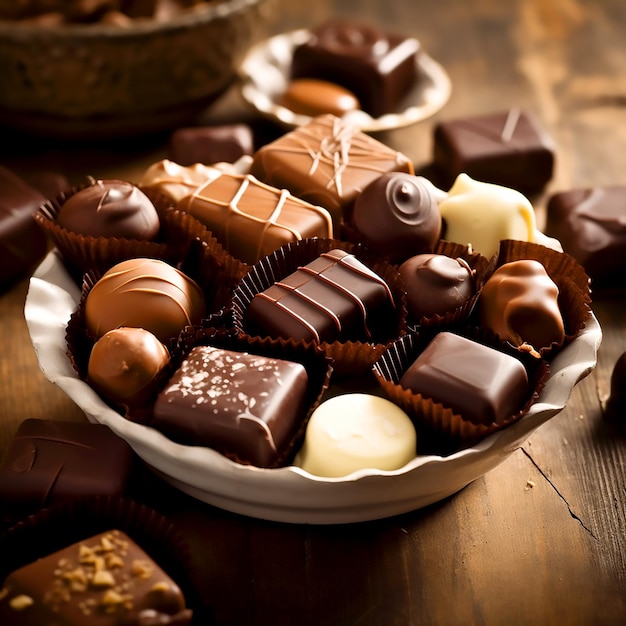
Find the location of `chocolate that appears to be loose on table`. chocolate that appears to be loose on table is located at coordinates (513, 131), (81, 459), (27, 203), (618, 402), (582, 221), (218, 146).